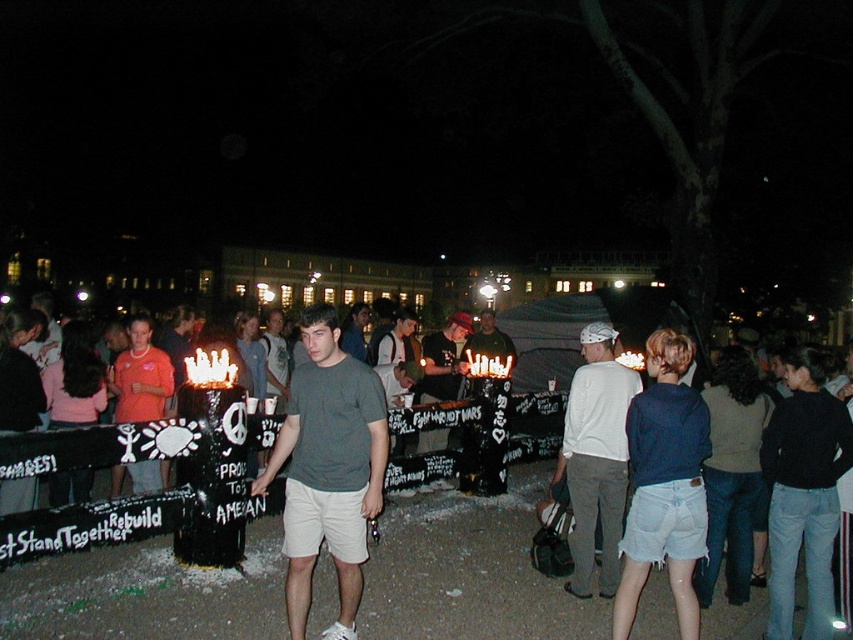
Question: Which of these objects is positioned closest to the white matte shirt at center?

Choices:
 (A) matte black t-shirt at center
 (B) gray cotton t-shirt at center

Answer: (B)

Question: Does white matte shirt at center have a lesser width compared to matte black t-shirt at center?

Choices:
 (A) yes
 (B) no

Answer: (B)

Question: Can you confirm if white matte shirt at center is smaller than matte black t-shirt at center?

Choices:
 (A) yes
 (B) no

Answer: (B)

Question: Which point is farther to the camera?

Choices:
 (A) [608, 394]
 (B) [445, 348]

Answer: (B)

Question: Considering the relative positions of gray cotton t-shirt at center and white matte shirt at center in the image provided, where is gray cotton t-shirt at center located with respect to white matte shirt at center?

Choices:
 (A) left
 (B) right

Answer: (A)

Question: Based on their relative distances, which object is farther from the white matte shirt at center?

Choices:
 (A) matte black t-shirt at center
 (B) gray cotton t-shirt at center

Answer: (A)